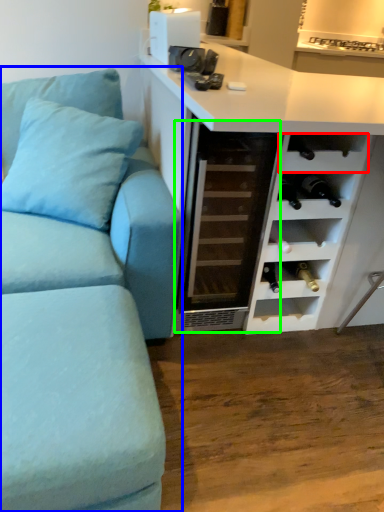
Question: Which is farther away from shelf (highlighted by a red box)? studio couch (highlighted by a blue box) or glass door (highlighted by a green box)?

Choices:
 (A) studio couch
 (B) glass door

Answer: (A)